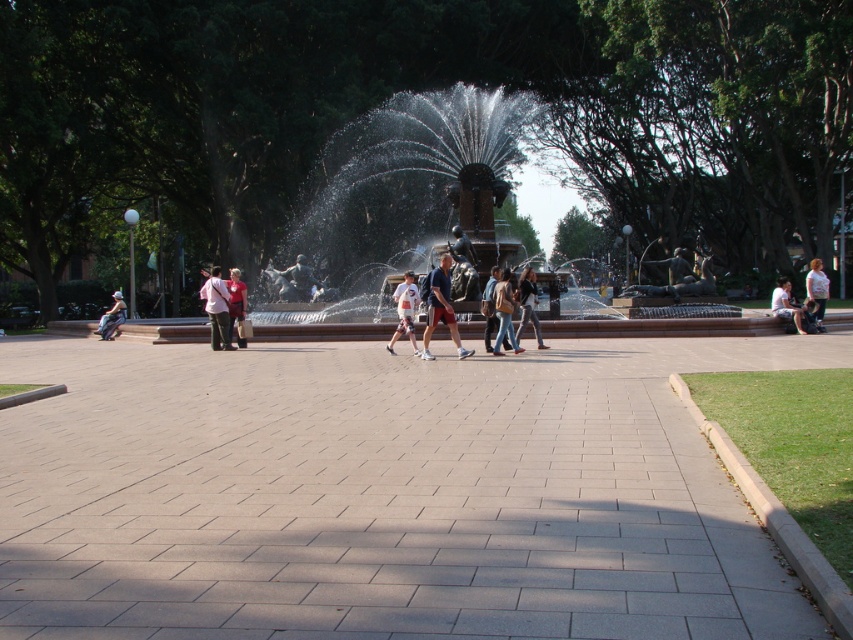
Consider the image. You are standing in the public square and want to take a photo of both the light brown leather jacket at right and the matte red shirt at center. Which one should you focus on first to ensure both are in the frame?

You should focus on the light brown leather jacket at right first because it is closer to you than the matte red shirt at center, ensuring both are in the frame.

You are a photographer standing in the public square. You notice two items at the center of the fountain area. Which item would require a closer shot to capture its details? The jeans at center or the matte black backpack at center?

The jeans at center is smaller than the matte black backpack at center, so to capture its details, you would need to take a closer shot of the jeans at center.

You are a photographer standing at the edge of the square, wanting to capture both the matte blue shorts at center and the matte red shirt at center in the same frame. Given that your camera has a maximum focal length that allows capturing objects up to 6 meters apart, will you be able to include both subjects in a single photo?

The matte blue shorts at center and matte red shirt at center are 6.41 meters apart, which exceeds the camera maximum focal length of 6 meters. Therefore, you cannot include both subjects in a single photo.